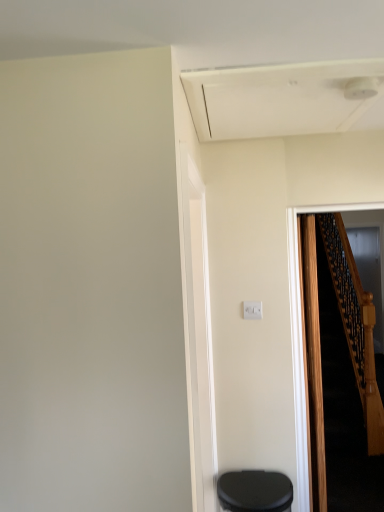
The width and height of the screenshot is (384, 512). What do you see at coordinates (347, 377) in the screenshot?
I see `wooden at right` at bounding box center [347, 377].

The width and height of the screenshot is (384, 512). Find the location of `transparent glass door at right`. transparent glass door at right is located at coordinates (369, 272).

Measure the distance between black matte trash can at lower right and camera.

black matte trash can at lower right and camera are 6.27 feet apart from each other.

Locate an element on the screen. wooden at right is located at coordinates (347, 377).

From the image's perspective, between black matte trash can at lower right and transparent glass door at right, which one is located above?

transparent glass door at right.

Is black matte trash can at lower right not near transparent glass door at right?

Yes, black matte trash can at lower right is far from transparent glass door at right.

From a real-world perspective, relative to transparent glass door at right, is black matte trash can at lower right vertically above or below?

In terms of real-world spatial position, black matte trash can at lower right is below transparent glass door at right.

Between point (273, 498) and point (366, 287), which one is positioned behind?

The point (366, 287) is behind.

Considering the points (363, 258) and (332, 221), which point is behind, point (363, 258) or point (332, 221)?

The point (363, 258) is more distant.

Does transparent glass door at right turn towards wooden at right?

No.

Consider the image. Which of these two, transparent glass door at right or wooden at right, is bigger?

wooden at right is bigger.

Based on the photo, considering the sizes of objects transparent glass door at right and wooden at right in the image provided, who is shorter, transparent glass door at right or wooden at right?

Standing shorter between the two is wooden at right.

From the picture: Is transparent glass door at right spatially inside white plastic electric outlet at center, or outside of it?

transparent glass door at right is located beyond the bounds of white plastic electric outlet at center.

Which is behind, transparent glass door at right or white plastic electric outlet at center?

transparent glass door at right.

Considering the sizes of objects transparent glass door at right and white plastic electric outlet at center in the image provided, who is shorter, transparent glass door at right or white plastic electric outlet at center?

white plastic electric outlet at center.

Can you confirm if black matte trash can at lower right is wider than white plastic electric outlet at center?

Yes, black matte trash can at lower right is wider than white plastic electric outlet at center.

Considering the points (253, 496) and (258, 306), which point is behind, point (253, 496) or point (258, 306)?

The point (258, 306) is farther.

Between black matte trash can at lower right and white plastic electric outlet at center, which one has larger size?

With larger size is black matte trash can at lower right.

Who is taller, black matte trash can at lower right or white plastic electric outlet at center?

With more height is black matte trash can at lower right.

Is black matte trash can at lower right at the back of transparent glass door at right?

transparent glass door at right does not have its back to black matte trash can at lower right.

Would you consider transparent glass door at right to be distant from black matte trash can at lower right?

transparent glass door at right is positioned a significant distance from black matte trash can at lower right.

Do you think transparent glass door at right is within black matte trash can at lower right, or outside of it?

transparent glass door at right lies outside black matte trash can at lower right.

Is transparent glass door at right at the right side of black matte trash can at lower right?

Yes.

From a real-world perspective, who is located higher, white plastic electric outlet at center or transparent glass door at right?

From a 3D spatial view, white plastic electric outlet at center is above.

Looking at the image, does white plastic electric outlet at center seem bigger or smaller compared to transparent glass door at right?

Considering their sizes, white plastic electric outlet at center takes up less space than transparent glass door at right.

Does white plastic electric outlet at center have a greater height compared to transparent glass door at right?

No.

Considering the relative sizes of white plastic electric outlet at center and transparent glass door at right in the image provided, is white plastic electric outlet at center thinner than transparent glass door at right?

Yes.

Looking at this image, from the image's perspective, between wooden at right and black matte trash can at lower right, who is located below?

black matte trash can at lower right, from the image's perspective.

Are wooden at right and black matte trash can at lower right far apart?

That's right, there is a large distance between wooden at right and black matte trash can at lower right.

Where is `stairs located above the black matte trash can at lower right (from a real-world perspective)`? This screenshot has width=384, height=512. stairs located above the black matte trash can at lower right (from a real-world perspective) is located at coordinates (347, 377).

Identify the location of glass door to the right of black matte trash can at lower right. (369, 272).

Identify the location of stairs that appears below the transparent glass door at right (from the image's perspective). The height and width of the screenshot is (512, 384). (347, 377).

Consider the image. Based on their spatial positions, is white plastic electric outlet at center or black matte trash can at lower right further from wooden at right?

Based on the image, white plastic electric outlet at center appears to be further to wooden at right.

Looking at the image, which one is located further to white plastic electric outlet at center, wooden at right or black matte trash can at lower right?

wooden at right is further to white plastic electric outlet at center.

When comparing their distances from wooden at right, does black matte trash can at lower right or transparent glass door at right seem further?

Based on the image, black matte trash can at lower right appears to be further to wooden at right.

Considering their positions, is black matte trash can at lower right positioned closer to wooden at right than white plastic electric outlet at center?

black matte trash can at lower right lies closer to wooden at right than the other object.

Which object lies further to the anchor point black matte trash can at lower right, white plastic electric outlet at center or transparent glass door at right?

The object further to black matte trash can at lower right is transparent glass door at right.

Looking at the image, which one is located closer to white plastic electric outlet at center, transparent glass door at right or black matte trash can at lower right?

The object closer to white plastic electric outlet at center is black matte trash can at lower right.

Estimate the real-world distances between objects in this image. Which object is further from white plastic electric outlet at center, black matte trash can at lower right or wooden at right?

wooden at right is positioned further to the anchor white plastic electric outlet at center.

Based on their spatial positions, is transparent glass door at right or white plastic electric outlet at center further from black matte trash can at lower right?

transparent glass door at right is further to black matte trash can at lower right.

The height and width of the screenshot is (512, 384). What are the coordinates of `stairs between black matte trash can at lower right and transparent glass door at right in the front-back direction` in the screenshot? It's located at (347, 377).

Where is `electric outlet between black matte trash can at lower right and transparent glass door at right along the z-axis`? Image resolution: width=384 pixels, height=512 pixels. electric outlet between black matte trash can at lower right and transparent glass door at right along the z-axis is located at coordinates (252, 310).

The width and height of the screenshot is (384, 512). In order to click on stairs between white plastic electric outlet at center and transparent glass door at right in the front-back direction in this screenshot , I will do `click(347, 377)`.

Identify the location of stairs between white plastic electric outlet at center and black matte trash can at lower right in the up-down direction. The width and height of the screenshot is (384, 512). (347, 377).